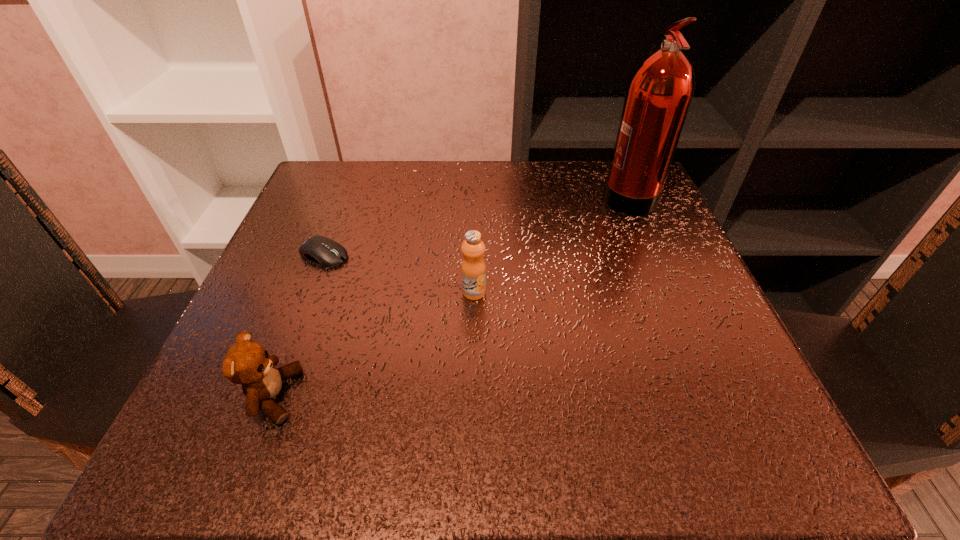
Where is `free space at the far edge of the desktop`? The width and height of the screenshot is (960, 540). free space at the far edge of the desktop is located at coordinates (441, 165).

Where is `vacant region at the near edge of the desktop`? vacant region at the near edge of the desktop is located at coordinates (499, 464).

In the image, there is a desktop. Identify the location of vacant space at the left edge. (303, 316).

You are a GUI agent. You are given a task and a screenshot of the screen. Output one action in this format:
    pyautogui.click(x=<x>, y=<y>)
    Task: Click on the free space at the right edge of the desktop
    Image resolution: width=960 pixels, height=540 pixels.
    Given the screenshot: What is the action you would take?
    pyautogui.click(x=662, y=286)

Locate an element on the screen. This screenshot has height=540, width=960. vacant position at the far left corner of the desktop is located at coordinates (332, 161).

Locate an element on the screen. The image size is (960, 540). vacant space at the far right corner of the desktop is located at coordinates (610, 162).

The image size is (960, 540). In the image, there is a desktop. Identify the location of vacant space at the near right corner. (730, 416).

At what (x,y) coordinates should I click in order to perform the action: click on vacant space that's between the rightmost object and the teddy bear. Please return your answer as a coordinate pair (x, y). Looking at the image, I should click on (450, 295).

The image size is (960, 540). In order to click on empty space between the rightmost object and the orange juice in this screenshot , I will do `click(551, 244)`.

Find the location of `blank region between the computer equipment and the nearest object`. blank region between the computer equipment and the nearest object is located at coordinates (299, 325).